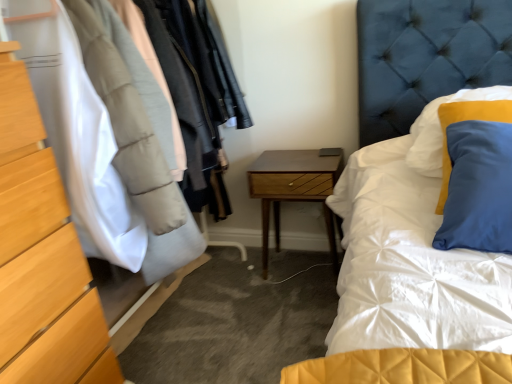
This screenshot has width=512, height=384. I want to click on free space in front of woodenmaterial/texturenightstand at center, so click(x=293, y=307).